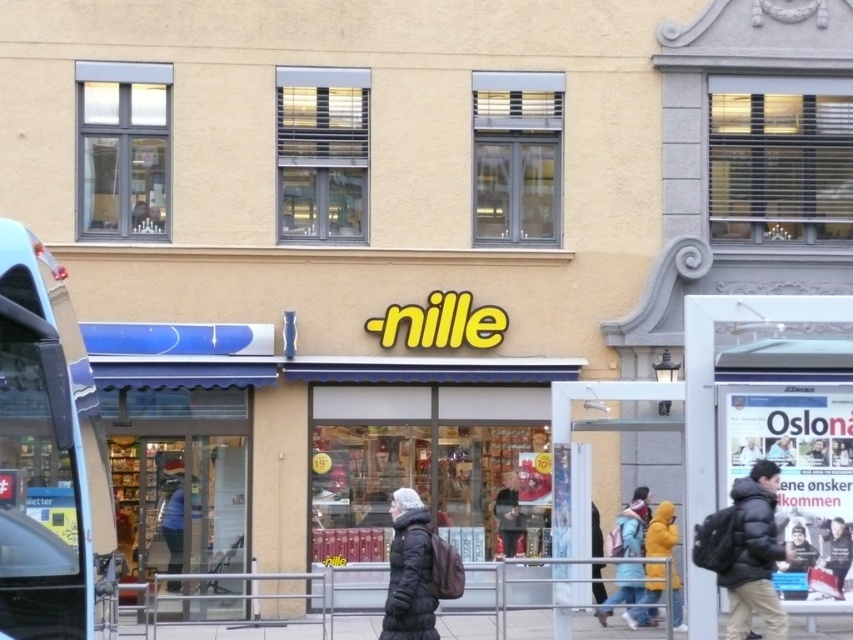
You are a delivery person with a cart that is 2 meters long. You need to move your cart from the gray concrete pavement at lower center to the dark gray jacket at center. Is there enough space between them for your cart to maneuver?

The distance between the gray concrete pavement at lower center and the dark gray jacket at center is 3.24 meters. Since the cart is 2 meters long, there is sufficient space for the cart to maneuver between them.